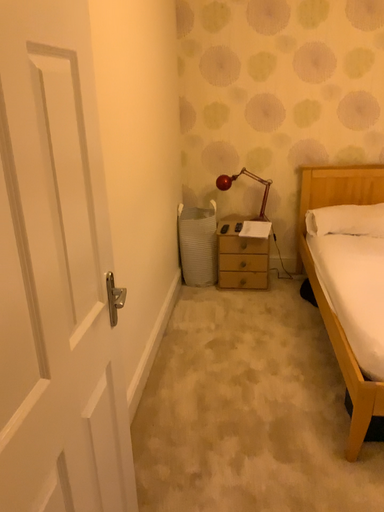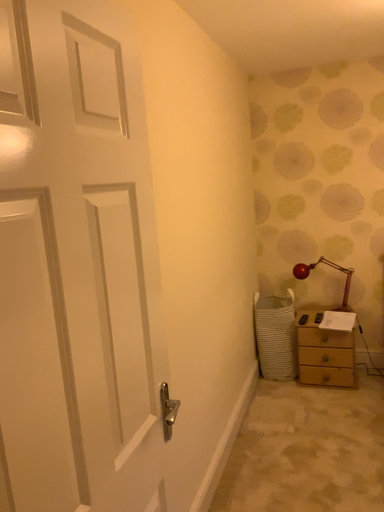
Question: How did the camera likely rotate when shooting the video?

Choices:
 (A) rotated left
 (B) rotated right

Answer: (A)